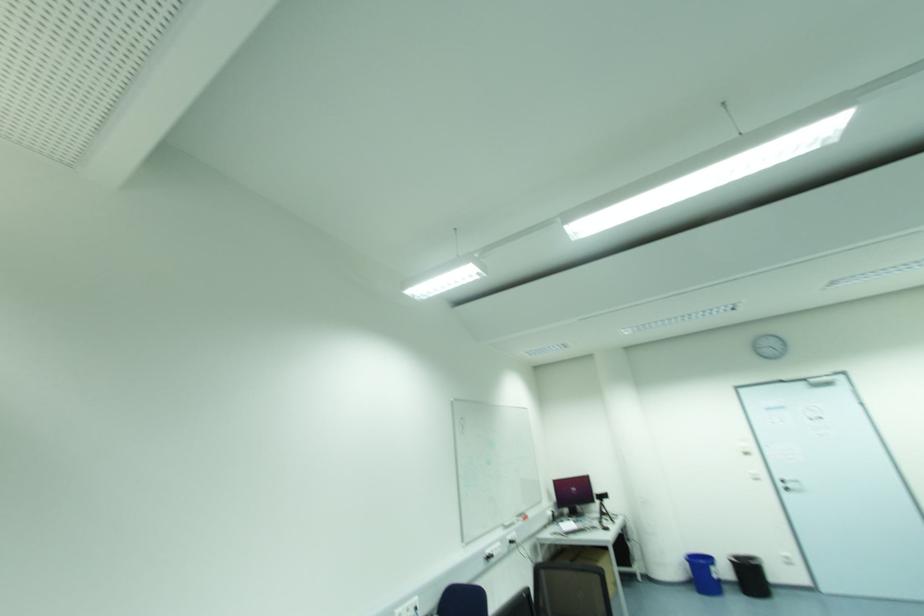
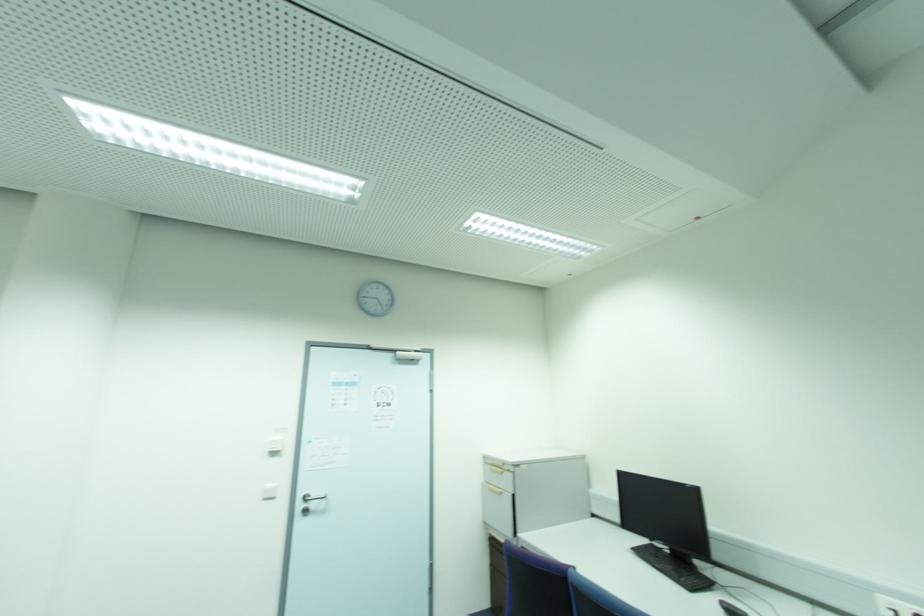
Where in the second image is the point corresponding to point 747,454 from the first image?

(274, 454)